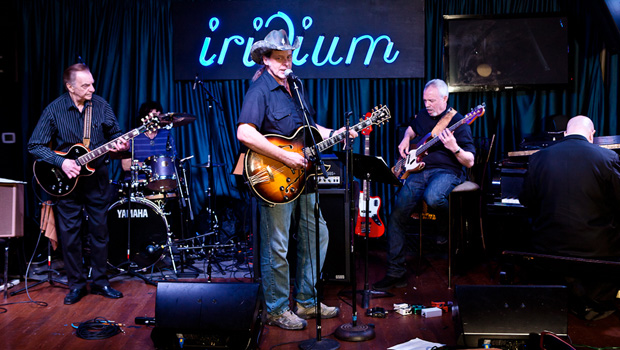
Where is `place to sit`? This screenshot has width=620, height=350. place to sit is located at coordinates (466, 183).